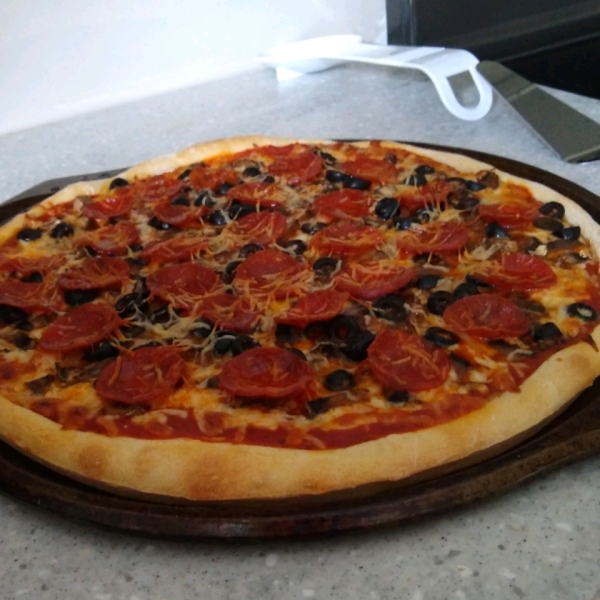
The image size is (600, 600). In order to click on white background wall in this screenshot , I will do `click(43, 87)`, `click(329, 20)`, `click(130, 17)`, `click(38, 23)`.